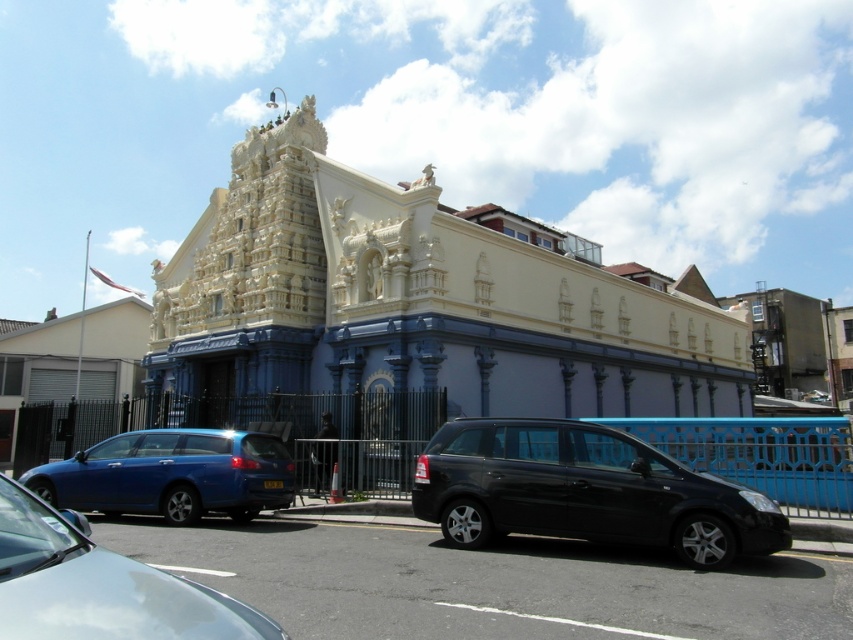
Is the position of black matte van at center more distant than that of shiny blue sedan at lower left?

Yes, black matte van at center is behind shiny blue sedan at lower left.

Can you confirm if black matte van at center is thinner than shiny blue sedan at lower left?

Yes, black matte van at center is thinner than shiny blue sedan at lower left.

Does point (550, 465) come in front of point (219, 609)?

No, it is behind (219, 609).

This screenshot has height=640, width=853. I want to click on black matte van at center, so click(585, 492).

Is white stone hindu temple at center above black matte van at center?

Yes, white stone hindu temple at center is above black matte van at center.

Which is below, white stone hindu temple at center or black matte van at center?

Positioned lower is black matte van at center.

Which is in front, point (309, 189) or point (460, 424)?

Point (460, 424) is in front.

Where is `white stone hindu temple at center`? This screenshot has height=640, width=853. white stone hindu temple at center is located at coordinates (418, 300).

Does black matte van at center appear over metallic blue station wagon at lower left?

Yes.

Which is below, black matte van at center or metallic blue station wagon at lower left?

metallic blue station wagon at lower left

Which is in front, point (511, 433) or point (219, 456)?

Point (511, 433) is in front.

The height and width of the screenshot is (640, 853). What are the coordinates of `black matte van at center` in the screenshot? It's located at (585, 492).